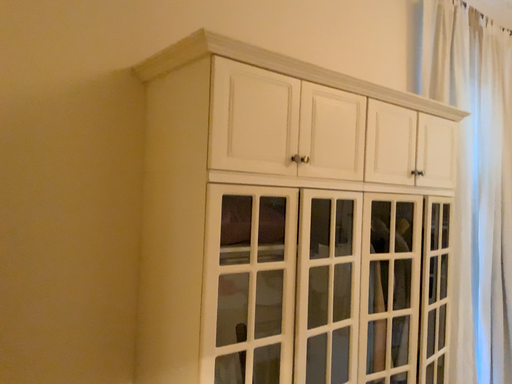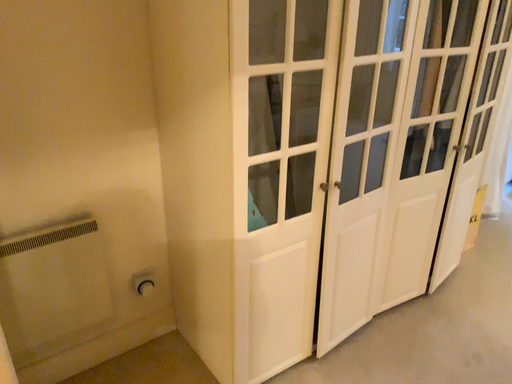
Question: How did the camera likely rotate when shooting the video?

Choices:
 (A) rotated upward
 (B) rotated downward

Answer: (B)